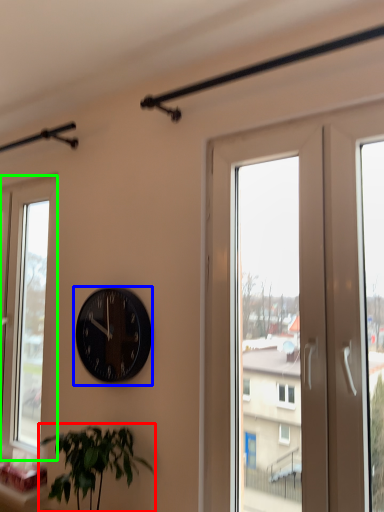
Question: Estimate the real-world distances between objects in this image. Which object is farther from houseplant (highlighted by a red box), wall clock (highlighted by a blue box) or window (highlighted by a green box)?

Choices:
 (A) wall clock
 (B) window

Answer: (B)